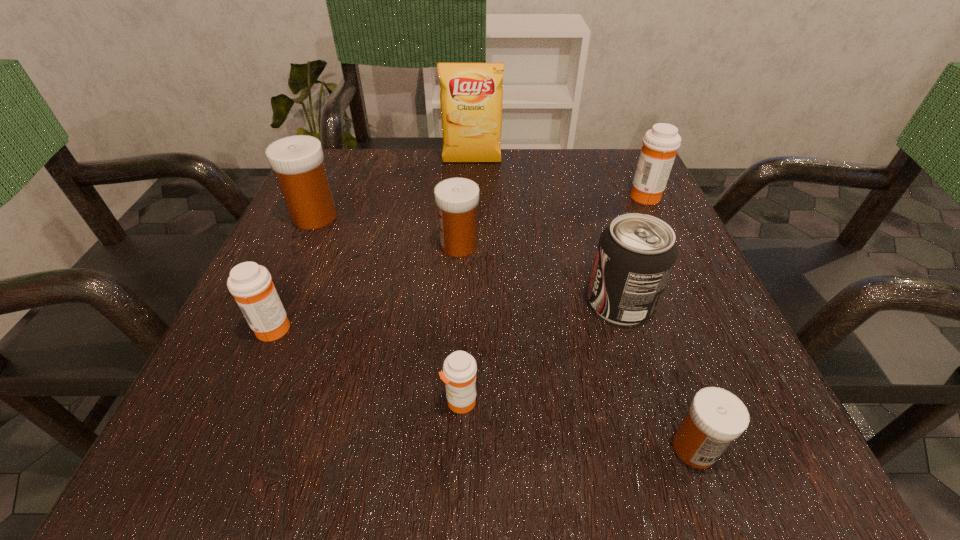
At what (x,y) coordinates should I click in order to perform the action: click on vacant region located 0.260m on the left of the second farthest white medicine. Please return your answer as a coordinate pair (x, y). Looking at the image, I should click on (297, 245).

Locate an element on the screen. free space located on the right of the second nearest medicine is located at coordinates (622, 401).

This screenshot has height=540, width=960. I want to click on free region located 0.180m on the left of the fifth medicine from left to right, so click(522, 448).

Find the location of a particular element. This screenshot has width=960, height=540. crisp (potato chip) that is at the far edge is located at coordinates (471, 96).

Image resolution: width=960 pixels, height=540 pixels. I want to click on soda can that is at the right edge, so click(x=635, y=256).

Where is `object that is positioned at the far left corner`? object that is positioned at the far left corner is located at coordinates (297, 160).

Where is `object that is at the far right corner`? object that is at the far right corner is located at coordinates (660, 144).

At what (x,y) coordinates should I click in order to perform the action: click on object at the near right corner. Please return your answer as a coordinate pair (x, y). This screenshot has height=540, width=960. Looking at the image, I should click on (716, 417).

The width and height of the screenshot is (960, 540). In the image, there is a desktop. Identify the location of blank space at the far edge. (400, 195).

The image size is (960, 540). I want to click on vacant space at the near edge, so click(x=603, y=429).